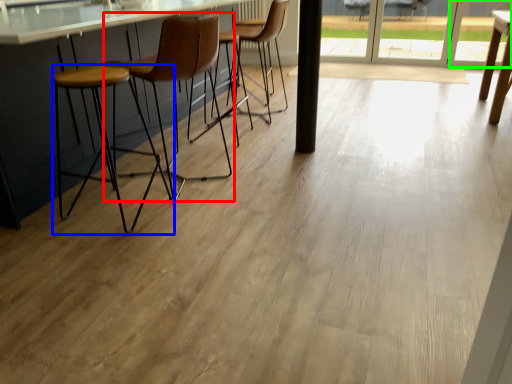
Question: Which object is positioned closest to chair (highlighted by a red box)? Select from stool (highlighted by a blue box) and window (highlighted by a green box).

Choices:
 (A) stool
 (B) window

Answer: (A)